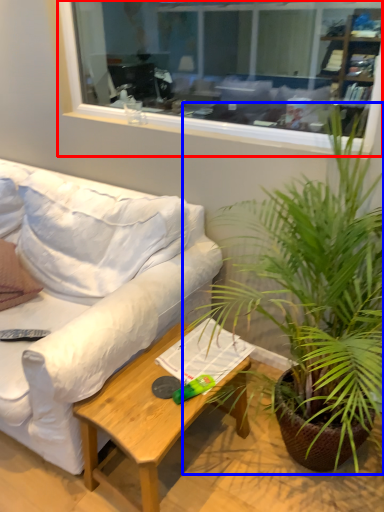
Question: Which point is further to the camera, window (highlighted by a red box) or houseplant (highlighted by a blue box)?

Choices:
 (A) window
 (B) houseplant

Answer: (A)